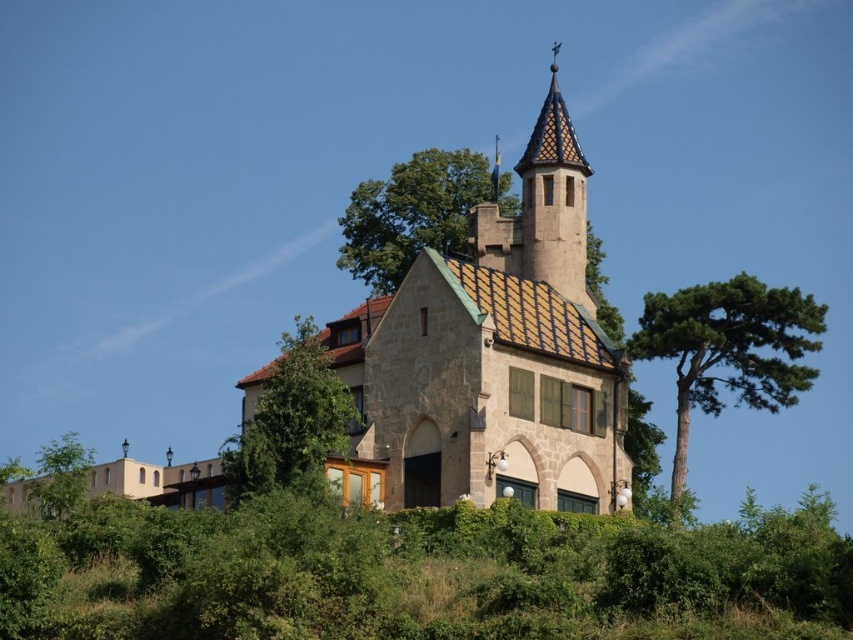
From the picture: You are standing in front of the brown stone church at center and want to take a photo of the glazed ceramic spire at upper center. Since you have a wide angle lens, will the spire appear smaller or larger in the photo compared to the church?

The brown stone church at center is closer to the viewer than the glazed ceramic spire at upper center. Since the spire is farther away, it will appear smaller in the photo compared to the church when using a wide angle lens.

You are standing in front of the building and notice a point at coordinates (728,349). Based on the scene description, what object or feature does this point most likely represent?

The point at coordinates (728,349) most likely represents the green textured tree at right.

From the picture: You are standing in a park and see the brown stone church at center. If you want to take a photo of the church from a distance of exactly 77.09 meters, where should you stand?

You should stand exactly where you are now because the brown stone church at center is already 77.09 meters away from your current position.